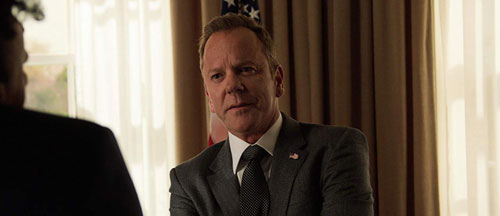
You are a GUI agent. You are given a task and a screenshot of the screen. Output one action in this format:
    pyautogui.click(x=<x>, y=<y>)
    Task: Click on the window
    The width and height of the screenshot is (500, 216).
    Given the screenshot: What is the action you would take?
    pyautogui.click(x=55, y=77)